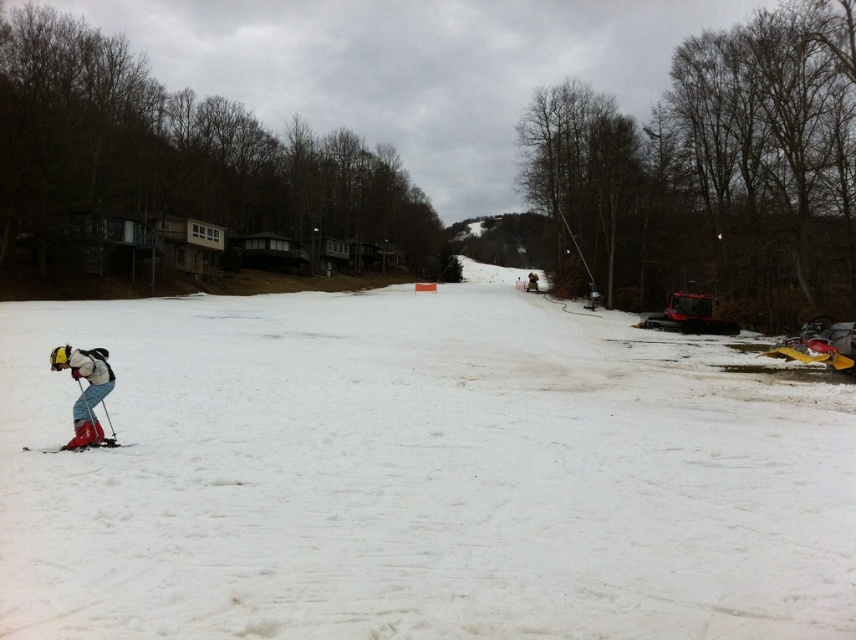
Question: Can you confirm if white powdery snow at center is smaller than matte red ski suit at lower left?

Choices:
 (A) no
 (B) yes

Answer: (A)

Question: Based on their relative distances, which object is farther from the white powdery snow at center?

Choices:
 (A) matte red ski at lower left
 (B) matte red ski suit at lower left

Answer: (B)

Question: Estimate the real-world distances between objects in this image. Which object is closer to the white powdery snow at center?

Choices:
 (A) matte red ski suit at lower left
 (B) matte red ski at lower left

Answer: (B)

Question: Which is nearer to the matte red ski suit at lower left?

Choices:
 (A) white powdery snow at center
 (B) matte red ski at lower left

Answer: (B)

Question: Observing the image, what is the correct spatial positioning of white powdery snow at center in reference to matte red ski suit at lower left?

Choices:
 (A) below
 (B) above

Answer: (B)

Question: Is white powdery snow at center to the right of matte red ski suit at lower left from the viewer's perspective?

Choices:
 (A) no
 (B) yes

Answer: (B)